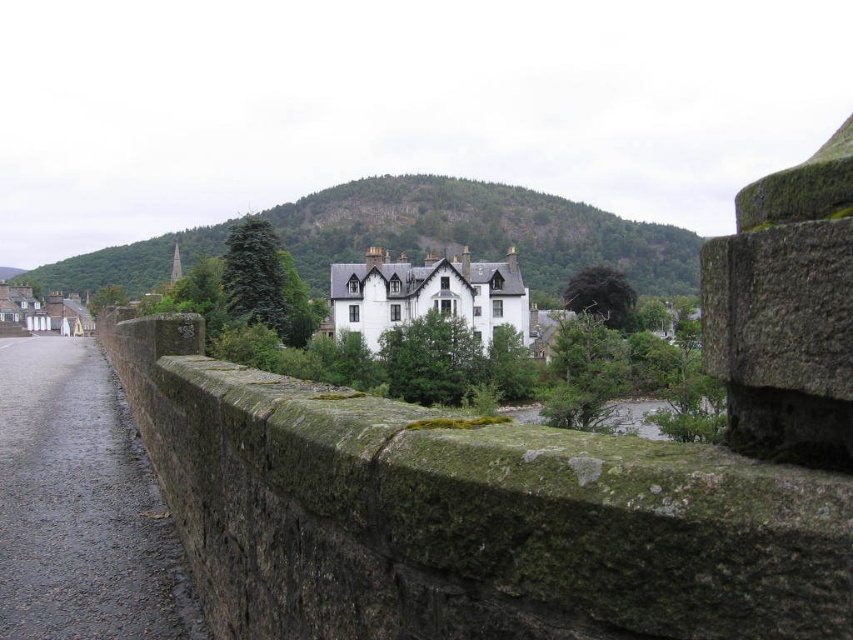
Question: Can you confirm if green mossy stone ledge at center is bigger than white painted stone building at center?

Choices:
 (A) no
 (B) yes

Answer: (B)

Question: Can you confirm if green mossy stone ledge at center is bigger than white painted stone building at center?

Choices:
 (A) yes
 (B) no

Answer: (A)

Question: Which point appears closest to the camera in this image?

Choices:
 (A) (514, 257)
 (B) (219, 556)

Answer: (B)

Question: Is green mossy stone ledge at center to the left of white painted stone building at center from the viewer's perspective?

Choices:
 (A) yes
 (B) no

Answer: (A)

Question: Which point appears closest to the camera in this image?

Choices:
 (A) (514, 317)
 (B) (223, 380)

Answer: (B)